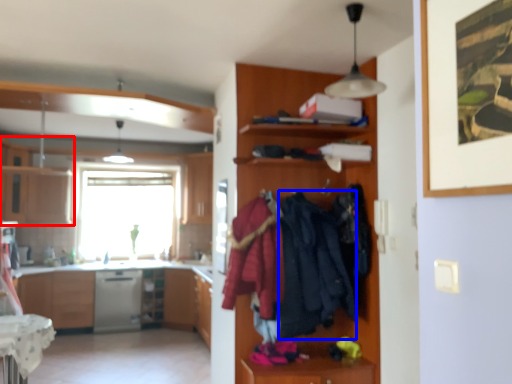
Question: Among these objects, which one is nearest to the camera, cabinetry (highlighted by a red box) or clothing (highlighted by a blue box)?

Choices:
 (A) cabinetry
 (B) clothing

Answer: (B)